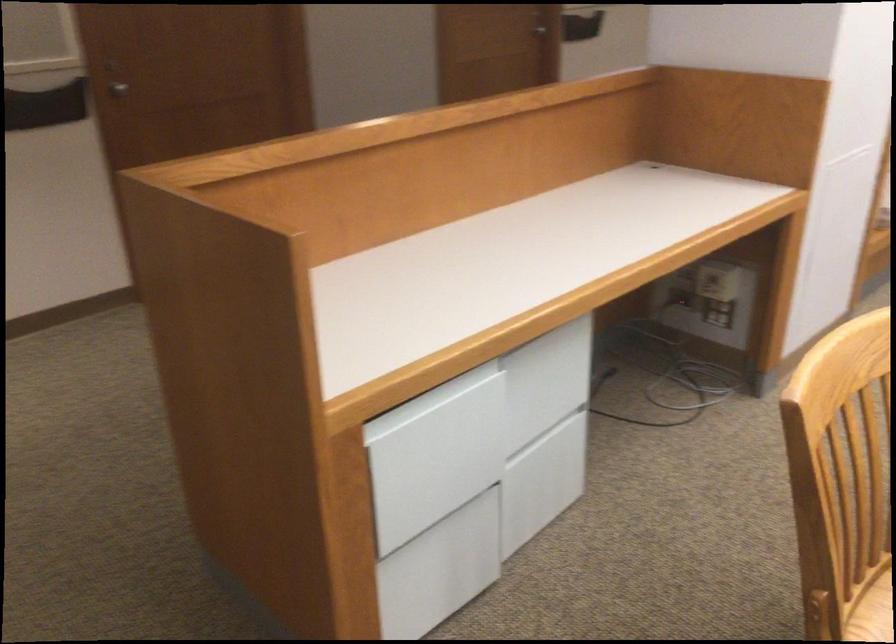
What do you see at coordinates (117, 89) in the screenshot? I see `the metal door knob` at bounding box center [117, 89].